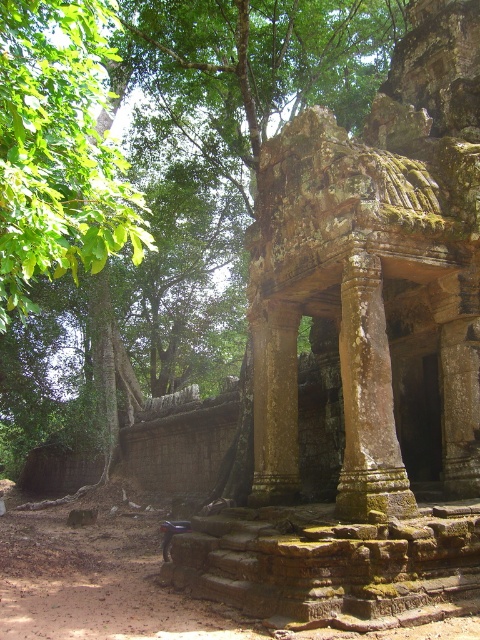
Who is taller, green leafy tree at upper left or weathered stone column at center?

Standing taller between the two is green leafy tree at upper left.

Who is higher up, green leafy tree at upper left or weathered stone column at center?

green leafy tree at upper left is higher up.

Does point (36, 84) lie in front of point (363, 401)?

That is True.

At what (x,y) coordinates should I click in order to perform the action: click on green leafy tree at upper left. Please return your answer as a coordinate pair (x, y). Looking at the image, I should click on (59, 148).